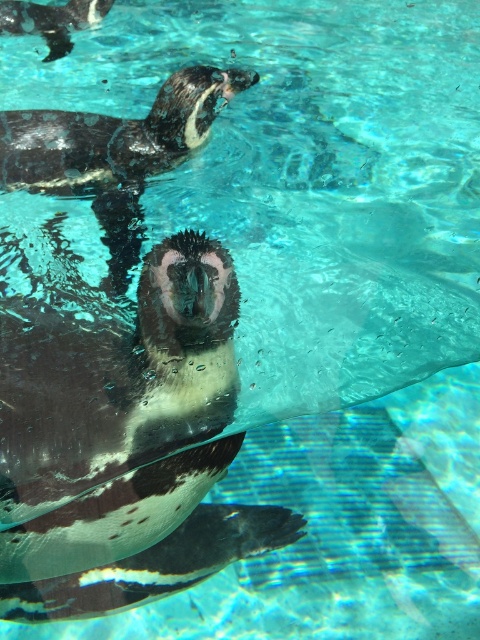
Question: Can you confirm if black glossy penguin at center is positioned to the left of black glossy penguin at upper left?

Choices:
 (A) yes
 (B) no

Answer: (B)

Question: Among these objects, which one is farthest from the camera?

Choices:
 (A) black glossy penguin at upper center
 (B) black glossy penguin at upper left
 (C) black glossy penguin at center

Answer: (B)

Question: Does black glossy penguin at center have a lesser width compared to black glossy penguin at upper center?

Choices:
 (A) no
 (B) yes

Answer: (B)

Question: Can you confirm if black glossy penguin at upper center is positioned to the right of black glossy penguin at upper left?

Choices:
 (A) no
 (B) yes

Answer: (B)

Question: Estimate the real-world distances between objects in this image. Which object is closer to the black glossy penguin at upper left?

Choices:
 (A) black glossy penguin at center
 (B) black glossy penguin at upper center

Answer: (B)

Question: Which is farther from the black glossy penguin at upper center?

Choices:
 (A) black glossy penguin at center
 (B) black glossy penguin at upper left

Answer: (B)